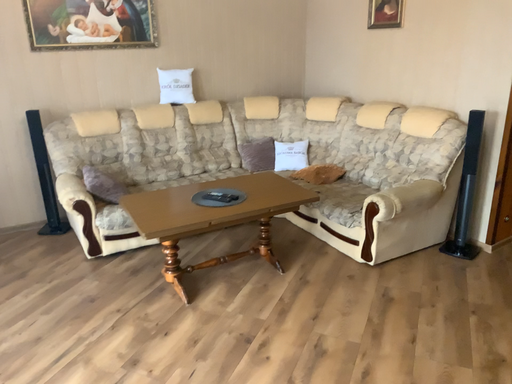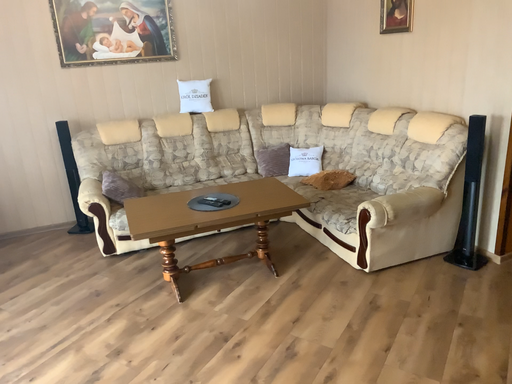
Question: How did the camera likely rotate when shooting the video?

Choices:
 (A) rotated right
 (B) rotated left

Answer: (B)